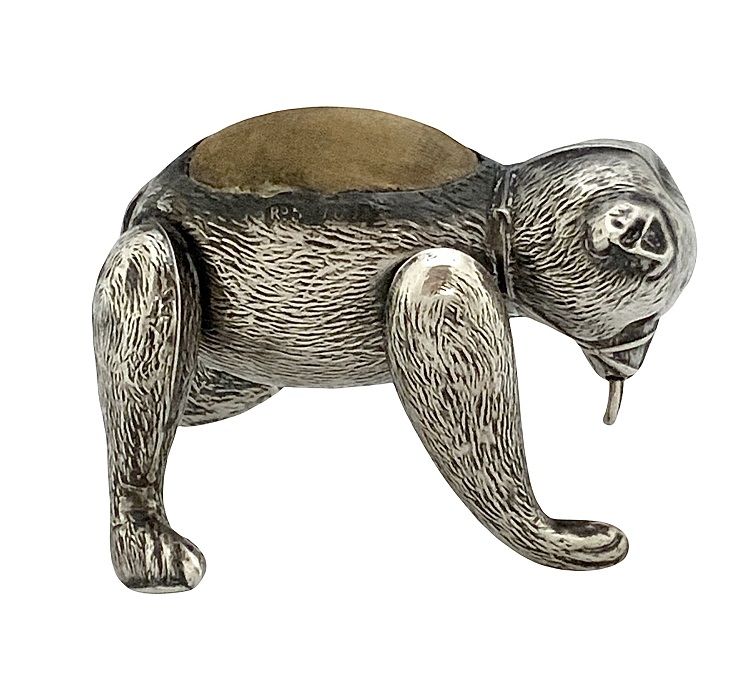
Where is `figurine`? This screenshot has width=754, height=700. figurine is located at coordinates (293, 259).